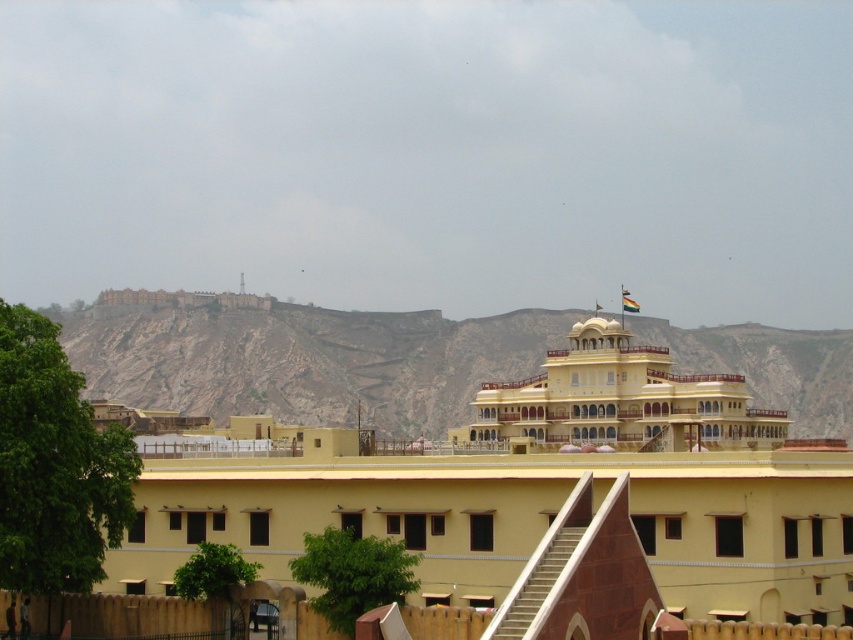
Between yellow matte building at center and brown rocky mountain at upper left, which one appears on the left side from the viewer's perspective?

yellow matte building at center is more to the left.

Can you confirm if yellow matte building at center is shorter than brown rocky mountain at upper left?

Correct, yellow matte building at center is not as tall as brown rocky mountain at upper left.

This screenshot has width=853, height=640. What do you see at coordinates (535, 490) in the screenshot?
I see `yellow matte building at center` at bounding box center [535, 490].

Find the location of a particular element. Image resolution: width=853 pixels, height=640 pixels. yellow matte building at center is located at coordinates (535, 490).

Can you confirm if brown rocky mountain at upper left is thinner than matte yellow building at center?

No.

Is brown rocky mountain at upper left above matte yellow building at center?

Actually, brown rocky mountain at upper left is below matte yellow building at center.

Where is `brown rocky mountain at upper left`? This screenshot has height=640, width=853. brown rocky mountain at upper left is located at coordinates (302, 358).

You are a GUI agent. You are given a task and a screenshot of the screen. Output one action in this format:
    pyautogui.click(x=<x>, y=<y>)
    Task: Click on the brown rocky mountain at upper left
    
    Given the screenshot: What is the action you would take?
    pyautogui.click(x=302, y=358)

Who is more forward, (612,352) or (619,444)?

Point (619,444)

Who is lower down, yellow matte building at center or matte yellow building at center?

yellow matte building at center

Identify the location of yellow matte building at center. Image resolution: width=853 pixels, height=640 pixels. (535, 490).